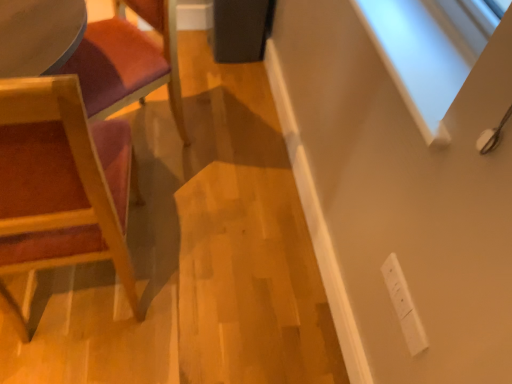
Question: Is white plastic electric outlet at lower right positioned before wooden chair at left, marked as the 1th chair in a top-to-bottom arrangement?

Choices:
 (A) yes
 (B) no

Answer: (A)

Question: Is wooden chair at left, the 2th chair ordered from the bottom, completely or partially inside white plastic electric outlet at lower right?

Choices:
 (A) yes
 (B) no

Answer: (B)

Question: Does white plastic electric outlet at lower right appear on the right side of wooden chair at left, the 2th chair ordered from the bottom?

Choices:
 (A) yes
 (B) no

Answer: (A)

Question: Are white plastic electric outlet at lower right and wooden chair at left, marked as the 1th chair in a top-to-bottom arrangement, located far from each other?

Choices:
 (A) yes
 (B) no

Answer: (A)

Question: Is wooden chair at left, marked as the 1th chair in a top-to-bottom arrangement, at the back of white plastic electric outlet at lower right?

Choices:
 (A) yes
 (B) no

Answer: (B)

Question: From a real-world perspective, is wooden chair at left, the 2th chair ordered from the bottom, above or below wooden chair at left, which is counted as the second chair, starting from the top?

Choices:
 (A) above
 (B) below

Answer: (B)

Question: From the image's perspective, relative to wooden chair at left, arranged as the 1th chair when ordered from the bottom, is wooden chair at left, marked as the 1th chair in a top-to-bottom arrangement, above or below?

Choices:
 (A) above
 (B) below

Answer: (A)

Question: Is point (141, 67) closer or farther from the camera than point (76, 223)?

Choices:
 (A) closer
 (B) farther

Answer: (B)

Question: Is wooden chair at left, marked as the 1th chair in a top-to-bottom arrangement, inside or outside of wooden chair at left, which is counted as the second chair, starting from the top?

Choices:
 (A) outside
 (B) inside

Answer: (A)

Question: Based on their sizes in the image, would you say white plastic electric outlet at lower right is bigger or smaller than wooden chair at left, which is counted as the second chair, starting from the top?

Choices:
 (A) small
 (B) big

Answer: (A)

Question: From a real-world perspective, is white plastic electric outlet at lower right physically located above or below wooden chair at left, which is counted as the second chair, starting from the top?

Choices:
 (A) above
 (B) below

Answer: (B)

Question: Is point (391, 268) positioned closer to the camera than point (111, 182)?

Choices:
 (A) closer
 (B) farther

Answer: (A)

Question: In the image, is white plastic electric outlet at lower right positioned in front of or behind wooden chair at left, which is counted as the second chair, starting from the top?

Choices:
 (A) behind
 (B) front

Answer: (A)

Question: Is point (69, 79) positioned closer to the camera than point (123, 86)?

Choices:
 (A) farther
 (B) closer

Answer: (B)

Question: Relative to wooden chair at left, the 2th chair ordered from the bottom, is wooden chair at left, which is counted as the second chair, starting from the top, in front or behind?

Choices:
 (A) behind
 (B) front

Answer: (B)